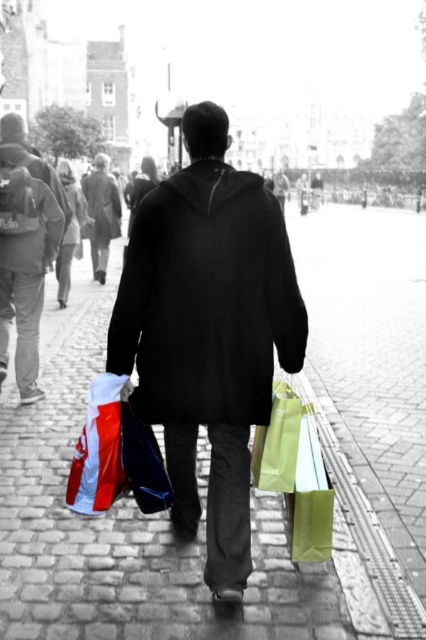
Question: Does white glossy shopping bag at lower left appear on the left side of matte green paper bag at lower right?

Choices:
 (A) no
 (B) yes

Answer: (B)

Question: Which of the following is the farthest from the observer?

Choices:
 (A) black matte coat at center
 (B) cobblestone pavement at center
 (C) matte green paper bag at lower right

Answer: (C)

Question: Does black matte coat at center appear on the left side of matte green paper bag at lower right?

Choices:
 (A) no
 (B) yes

Answer: (B)

Question: Can you confirm if black matte coat at center is smaller than matte black hoodie at upper left?

Choices:
 (A) yes
 (B) no

Answer: (B)

Question: Based on their relative distances, which object is farther from the white glossy shopping bag at lower left?

Choices:
 (A) matte green plastic bag at lower right
 (B) black matte coat at center

Answer: (A)

Question: Estimate the real-world distances between objects in this image. Which object is closer to the matte green paper bag at lower right?

Choices:
 (A) white glossy shopping bag at lower left
 (B) matte green plastic bag at lower right
 (C) cobblestone pavement at center

Answer: (B)